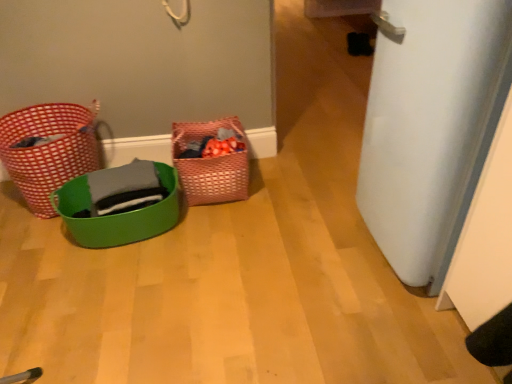
This screenshot has width=512, height=384. I want to click on vacant region in front of red woven basket at left, the third basket when ordered from right to left, so click(x=27, y=244).